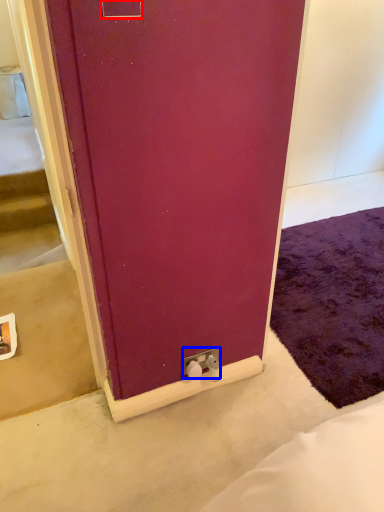
Question: Which point is further to the camera, electric outlet (highlighted by a red box) or electric outlet (highlighted by a blue box)?

Choices:
 (A) electric outlet
 (B) electric outlet

Answer: (B)